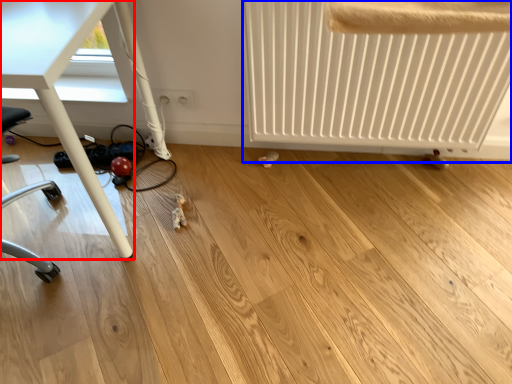
Question: Which object appears farthest to the camera in this image, table (highlighted by a red box) or radiator (highlighted by a blue box)?

Choices:
 (A) table
 (B) radiator

Answer: (B)